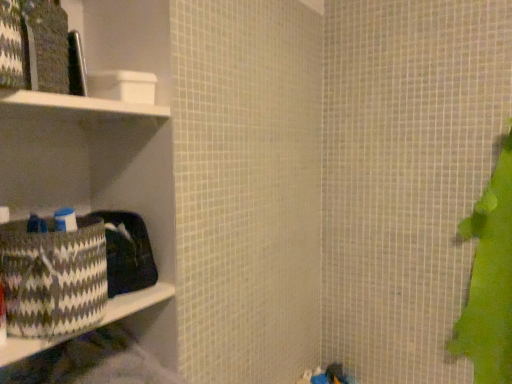
Question: Does white matte cabinet at upper left have a smaller size compared to patterned fabric basket at left?

Choices:
 (A) no
 (B) yes

Answer: (B)

Question: From the image's perspective, is white matte cabinet at upper left located beneath patterned fabric basket at left?

Choices:
 (A) yes
 (B) no

Answer: (B)

Question: Is white matte cabinet at upper left bigger than patterned fabric basket at left?

Choices:
 (A) no
 (B) yes

Answer: (A)

Question: Can you confirm if white matte cabinet at upper left is thinner than patterned fabric basket at left?

Choices:
 (A) no
 (B) yes

Answer: (B)

Question: Is white matte cabinet at upper left positioned with its back to patterned fabric basket at left?

Choices:
 (A) yes
 (B) no

Answer: (B)

Question: Is white matte cabinet at upper left beside patterned fabric basket at left?

Choices:
 (A) yes
 (B) no

Answer: (B)

Question: Considering the relative sizes of white matte cabinet at upper left and patterned woven basket at left in the image provided, is white matte cabinet at upper left smaller than patterned woven basket at left?

Choices:
 (A) no
 (B) yes

Answer: (B)

Question: From the image's perspective, is white matte cabinet at upper left beneath patterned woven basket at left?

Choices:
 (A) yes
 (B) no

Answer: (B)

Question: Does white matte cabinet at upper left turn towards patterned woven basket at left?

Choices:
 (A) yes
 (B) no

Answer: (B)

Question: From the image's perspective, is white matte cabinet at upper left on patterned woven basket at left?

Choices:
 (A) yes
 (B) no

Answer: (A)

Question: Is the depth of white matte cabinet at upper left less than that of patterned woven basket at left?

Choices:
 (A) yes
 (B) no

Answer: (A)

Question: Would you say white matte cabinet at upper left is a long distance from patterned woven basket at left?

Choices:
 (A) yes
 (B) no

Answer: (B)

Question: Is patterned fabric basket at left turned away from white matte cabinet at upper left?

Choices:
 (A) no
 (B) yes

Answer: (A)